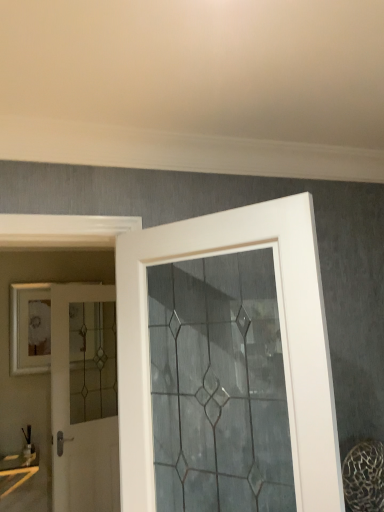
Question: Considering the positions of white glass door at center, the first door from the front, and white glass door at left, acting as the first door starting from the left, in the image, is white glass door at center, the first door from the front, taller or shorter than white glass door at left, acting as the first door starting from the left,?

Choices:
 (A) short
 (B) tall

Answer: (A)

Question: From the image's perspective, is white glass door at center, which appears as the second door when viewed from the left, above or below white glass door at left, the first door in the back-to-front sequence?

Choices:
 (A) below
 (B) above

Answer: (B)

Question: Relative to white glass door at left, the second door when ordered from right to left, is white glass door at center, which appears as the second door when viewed from the left, in front or behind?

Choices:
 (A) front
 (B) behind

Answer: (A)

Question: Choose the correct answer: Is white glass door at left, the first door in the back-to-front sequence, inside white glass door at center, which is the first door from right to left, or outside it?

Choices:
 (A) outside
 (B) inside

Answer: (A)

Question: Is white glass door at left, acting as the first door starting from the left, taller or shorter than white glass door at center, the first door from the front?

Choices:
 (A) short
 (B) tall

Answer: (B)

Question: From a real-world perspective, is white glass door at left, acting as the first door starting from the left, positioned above or below white glass door at center, arranged as the second door when viewed from the back?

Choices:
 (A) below
 (B) above

Answer: (A)

Question: From the image's perspective, is white glass door at left, the first door in the back-to-front sequence, above or below white glass door at center, which is the first door from right to left?

Choices:
 (A) above
 (B) below

Answer: (B)